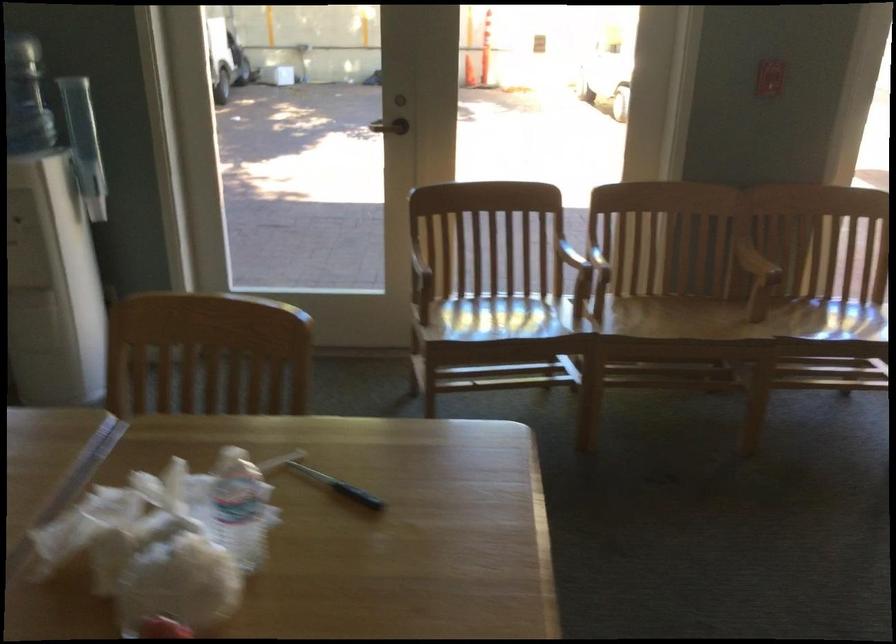
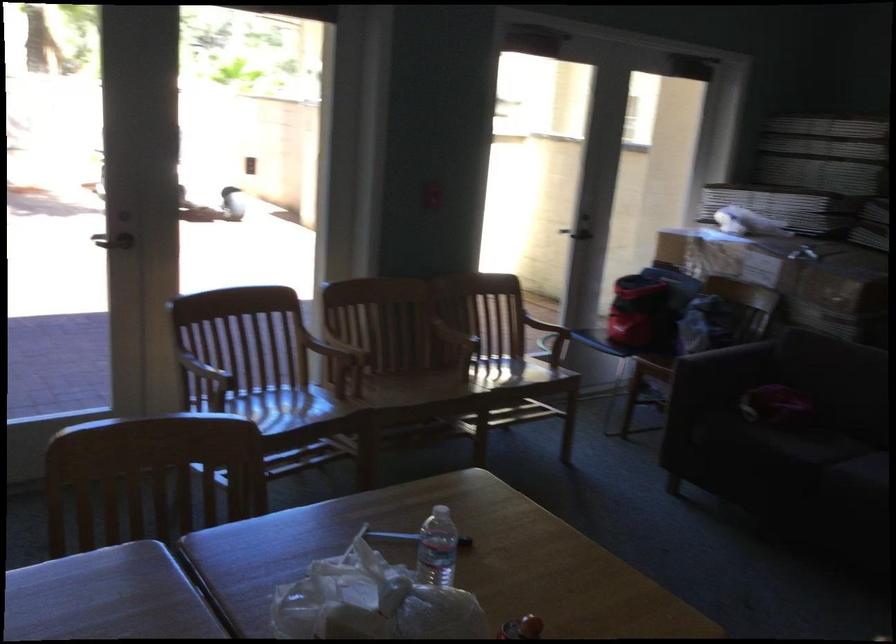
Locate, in the second image, the point that corresponds to pixel 616 238 in the first image.

(340, 333)